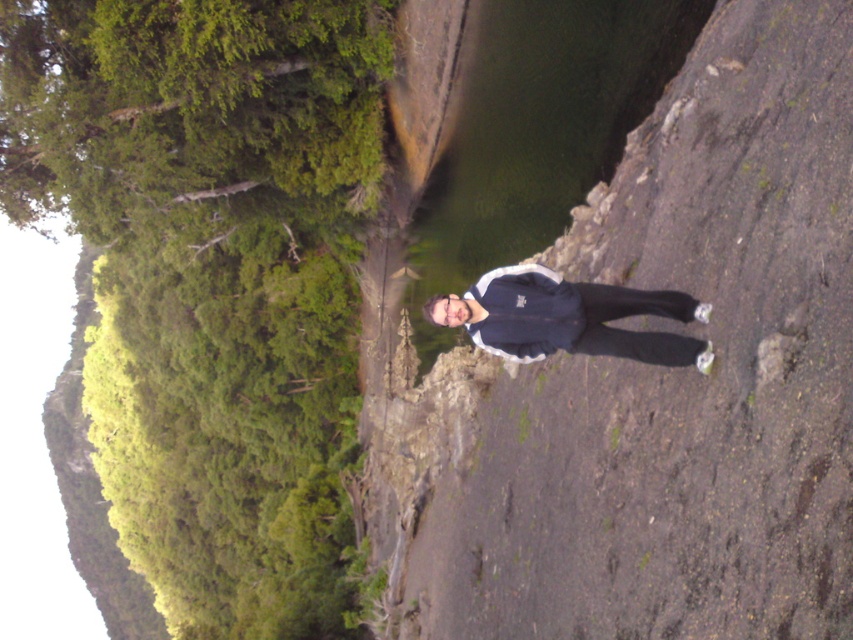
Question: Does dull gray rock at center appear over dark blue fabric jacket at center?

Choices:
 (A) yes
 (B) no

Answer: (B)

Question: Can you confirm if dull gray rock at center is bigger than dark blue fabric jacket at center?

Choices:
 (A) no
 (B) yes

Answer: (B)

Question: Does dull gray rock at center appear over dark blue fabric jacket at center?

Choices:
 (A) yes
 (B) no

Answer: (B)

Question: Which object is closer to the camera taking this photo?

Choices:
 (A) dull gray rock at center
 (B) dark blue fabric jacket at center

Answer: (A)

Question: Which of the following is the closest to the observer?

Choices:
 (A) (682, 298)
 (B) (679, 492)

Answer: (B)

Question: Which point is closer to the camera?

Choices:
 (A) tap(532, 550)
 (B) tap(535, 317)

Answer: (B)